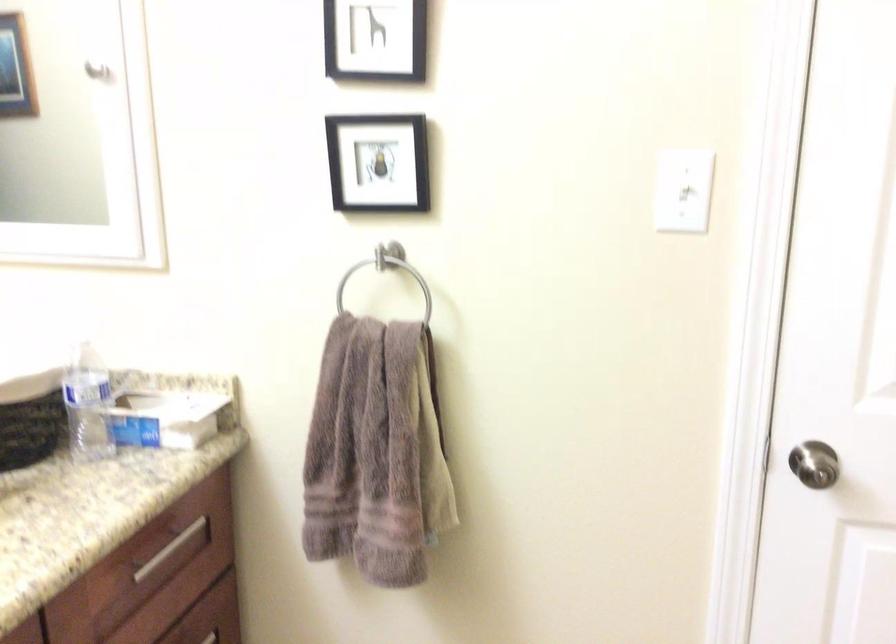
Where would you pull the metal drawer handle? Please return your answer as a coordinate pair (x, y).

(168, 549)